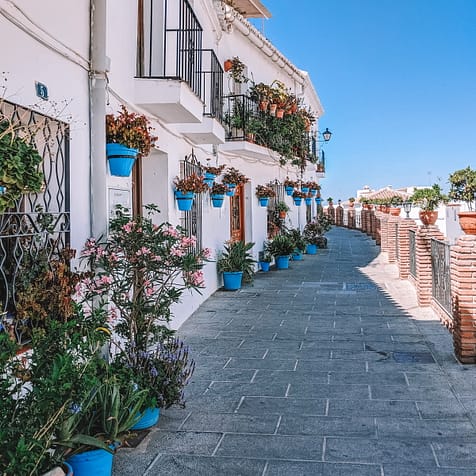
I want to click on door, so click(x=235, y=217), click(x=137, y=194).